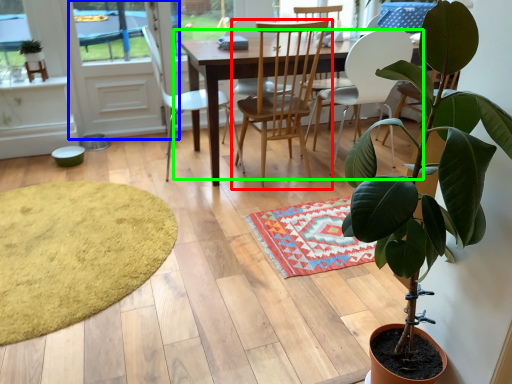
Question: Which object is positioned closest to chair (highlighted by a red box)? Select from screen door (highlighted by a blue box) and kitchen & dining room table (highlighted by a green box).

Choices:
 (A) screen door
 (B) kitchen & dining room table

Answer: (B)